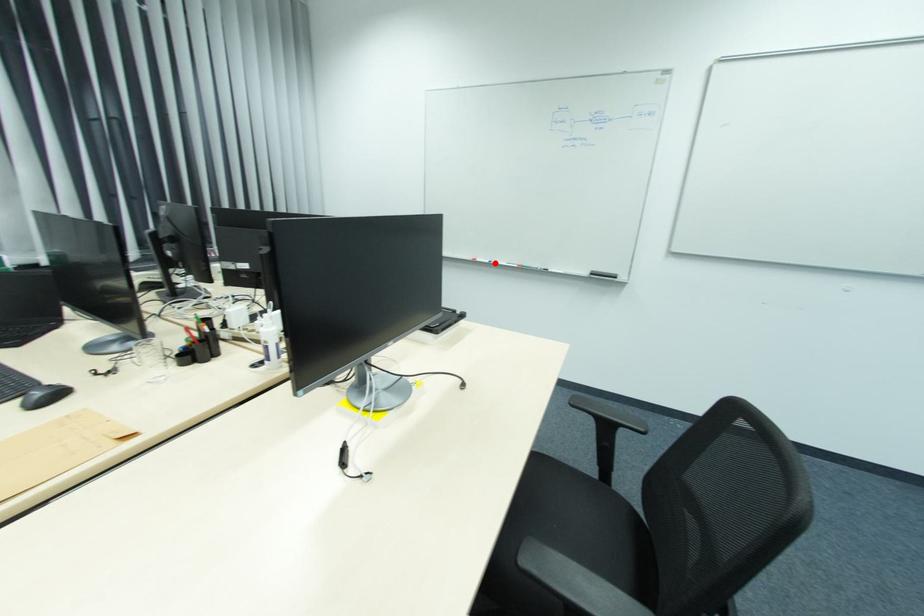
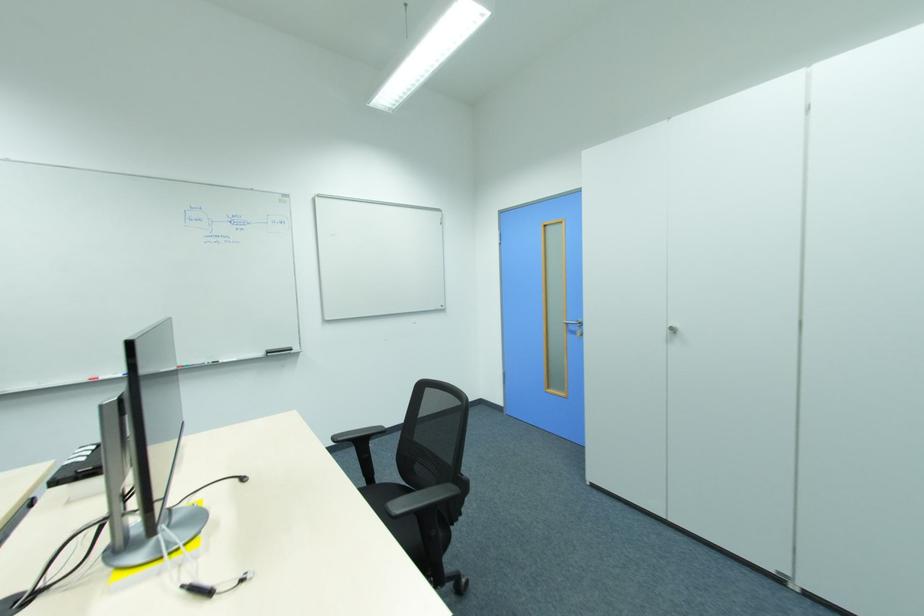
Question: I am providing you with two images of the same scene from different viewpoints. A red point is marked on the first image. At the location where the point appears in image 1, is it still visible in image 2?

Choices:
 (A) Yes
 (B) No

Answer: (B)